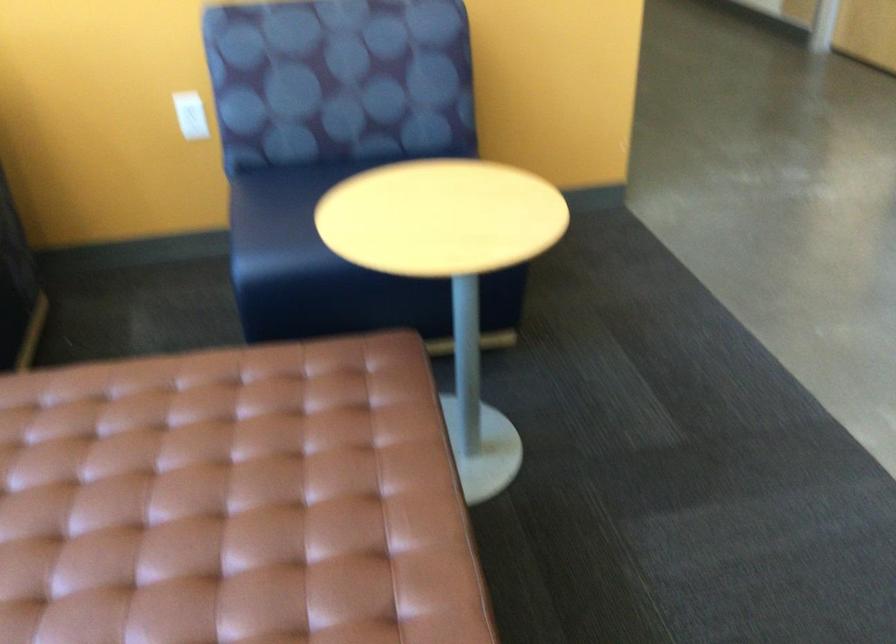
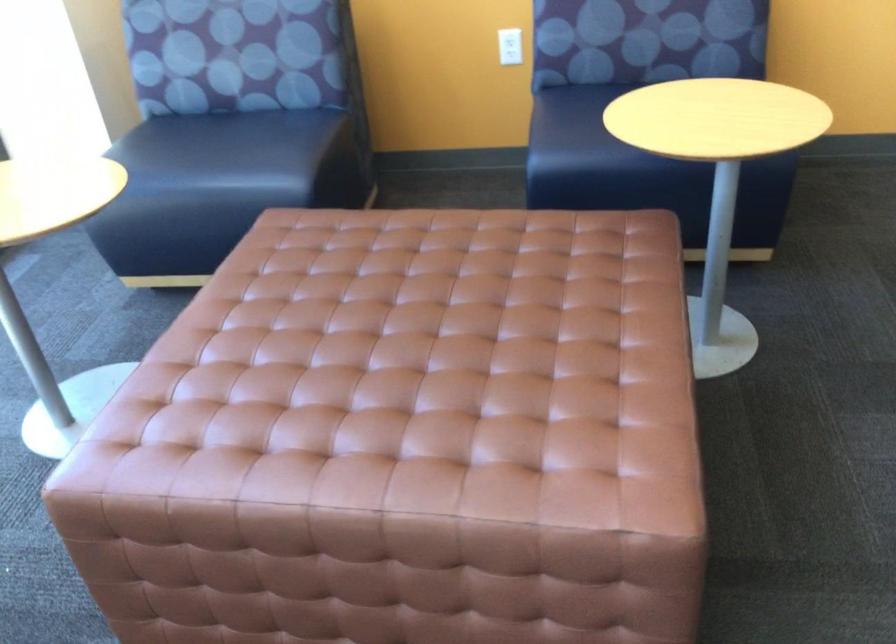
Question: How did the camera likely rotate?

Choices:
 (A) Left
 (B) Right
 (C) Up
 (D) Down

Answer: (A)